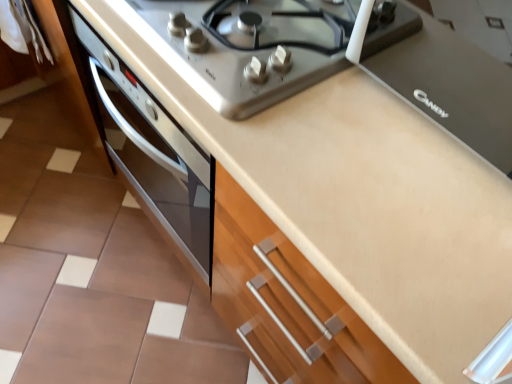
Question: From a real-world perspective, is black matte stove top at upper center positioned above or below satin silver gas stove at upper center?

Choices:
 (A) below
 (B) above

Answer: (B)

Question: Based on their positions, is black matte stove top at upper center located to the left or right of satin silver gas stove at upper center?

Choices:
 (A) right
 (B) left

Answer: (A)

Question: Is black matte stove top at upper center inside the boundaries of satin silver gas stove at upper center, or outside?

Choices:
 (A) inside
 (B) outside

Answer: (B)

Question: Considering the positions of satin silver gas stove at upper center and black matte stove top at upper center in the image, is satin silver gas stove at upper center wider or thinner than black matte stove top at upper center?

Choices:
 (A) wide
 (B) thin

Answer: (A)

Question: Visually, is satin silver gas stove at upper center positioned to the left or to the right of black matte stove top at upper center?

Choices:
 (A) left
 (B) right

Answer: (A)

Question: Considering their positions, is satin silver gas stove at upper center located in front of or behind black matte stove top at upper center?

Choices:
 (A) behind
 (B) front

Answer: (A)

Question: In terms of size, does satin silver gas stove at upper center appear bigger or smaller than black matte stove top at upper center?

Choices:
 (A) small
 (B) big

Answer: (A)